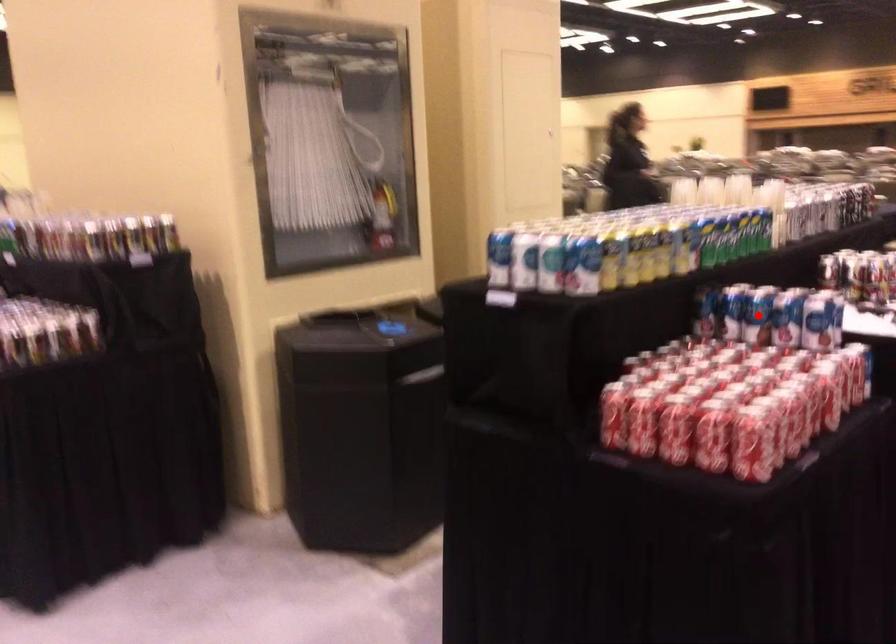
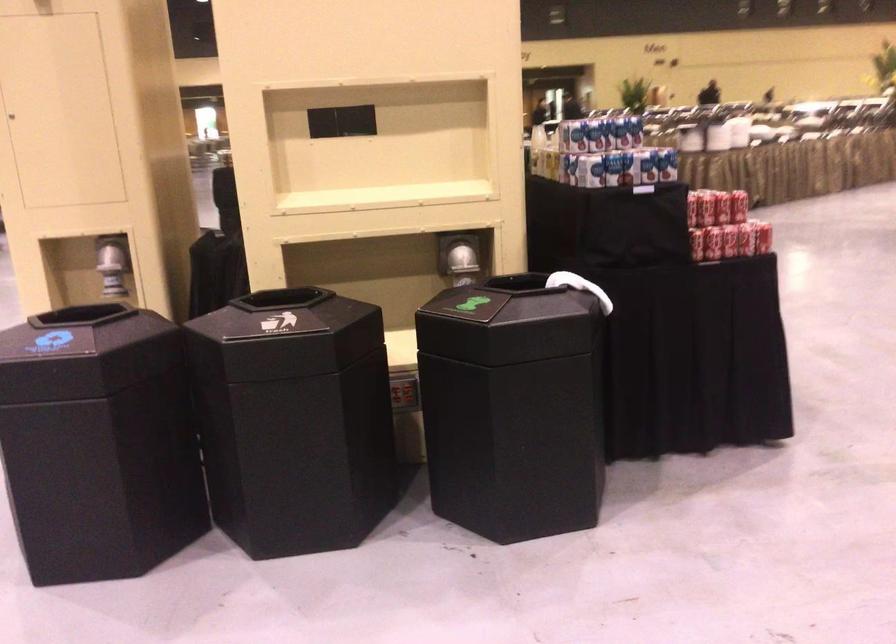
Question: I am providing you with two images of the same scene from different viewpoints. A red point is marked on the first image. Can you still see the location of the red point in image 2?

Choices:
 (A) Yes
 (B) No

Answer: (B)